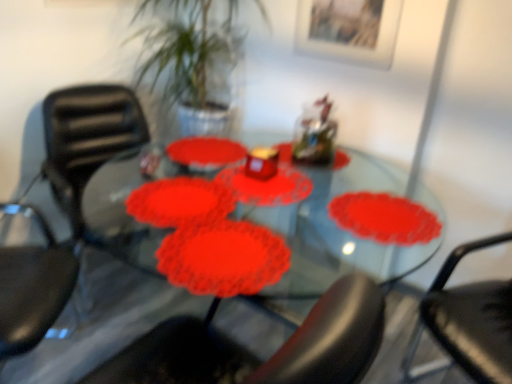
Describe the element at coordinates (468, 322) in the screenshot. I see `black plastic chair at right, acting as the 1th chair starting from the right` at that location.

What is the approximate width of black plastic chair at right, the second chair when ordered from left to right?

The width of black plastic chair at right, the second chair when ordered from left to right, is 29.70 inches.

The image size is (512, 384). I want to click on black plastic chair at right, the second chair when ordered from left to right, so click(x=468, y=322).

Image resolution: width=512 pixels, height=384 pixels. What are the coordinates of `matte black chair at left, the second chair in the right-to-left sequence` in the screenshot? It's located at (88, 145).

Describe the element at coordinates (88, 145) in the screenshot. I see `matte black chair at left, which ranks as the first chair in left-to-right order` at that location.

The height and width of the screenshot is (384, 512). Find the location of `black plastic chair at right, acting as the 1th chair starting from the right`. black plastic chair at right, acting as the 1th chair starting from the right is located at coordinates (468, 322).

Is black plastic chair at right, the second chair when ordered from left to right, at the left side of matte black chair at left, the second chair in the right-to-left sequence?

In fact, black plastic chair at right, the second chair when ordered from left to right, is to the right of matte black chair at left, the second chair in the right-to-left sequence.

Who is more distant, black plastic chair at right, the second chair when ordered from left to right, or matte black chair at left, which ranks as the first chair in left-to-right order?

Positioned behind is matte black chair at left, which ranks as the first chair in left-to-right order.

Which point is more forward, (451, 272) or (79, 150)?

The point (451, 272) is closer to the camera.

From the image's perspective, which one is positioned higher, black plastic chair at right, the second chair when ordered from left to right, or matte black chair at left, the second chair in the right-to-left sequence?

matte black chair at left, the second chair in the right-to-left sequence, is shown above in the image.

From a real-world perspective, which object stands above the other?

matte black chair at left, which ranks as the first chair in left-to-right order, is physically above.

Between black plastic chair at right, the second chair when ordered from left to right, and matte black chair at left, which ranks as the first chair in left-to-right order, which one has larger width?

With larger width is black plastic chair at right, the second chair when ordered from left to right.

Is black plastic chair at right, acting as the 1th chair starting from the right, taller or shorter than matte black chair at left, the second chair in the right-to-left sequence?

Clearly, black plastic chair at right, acting as the 1th chair starting from the right, is taller compared to matte black chair at left, the second chair in the right-to-left sequence.

Looking at the image, does black plastic chair at right, the second chair when ordered from left to right, seem bigger or smaller compared to matte black chair at left, the second chair in the right-to-left sequence?

black plastic chair at right, the second chair when ordered from left to right, is smaller than matte black chair at left, the second chair in the right-to-left sequence.

Would you say black plastic chair at right, acting as the 1th chair starting from the right, is outside matte black chair at left, the second chair in the right-to-left sequence?

Absolutely, black plastic chair at right, acting as the 1th chair starting from the right, is external to matte black chair at left, the second chair in the right-to-left sequence.

Are black plastic chair at right, the second chair when ordered from left to right, and matte black chair at left, which ranks as the first chair in left-to-right order, beside each other?

No, black plastic chair at right, the second chair when ordered from left to right, is not in contact with matte black chair at left, which ranks as the first chair in left-to-right order.

In the scene shown: Is black plastic chair at right, the second chair when ordered from left to right, turned away from matte black chair at left, the second chair in the right-to-left sequence?

black plastic chair at right, the second chair when ordered from left to right, does not have its back to matte black chair at left, the second chair in the right-to-left sequence.

How different are the orientations of black plastic chair at right, acting as the 1th chair starting from the right, and matte black chair at left, the second chair in the right-to-left sequence, in degrees?

105 degrees separate the facing orientations of black plastic chair at right, acting as the 1th chair starting from the right, and matte black chair at left, the second chair in the right-to-left sequence.

The height and width of the screenshot is (384, 512). Find the location of `chair to the left of black plastic chair at right, the second chair when ordered from left to right`. chair to the left of black plastic chair at right, the second chair when ordered from left to right is located at coordinates (88, 145).

Can you confirm if matte black chair at left, the second chair in the right-to-left sequence, is positioned to the right of black plastic chair at right, the second chair when ordered from left to right?

Incorrect, matte black chair at left, the second chair in the right-to-left sequence, is not on the right side of black plastic chair at right, the second chair when ordered from left to right.

Between matte black chair at left, which ranks as the first chair in left-to-right order, and black plastic chair at right, the second chair when ordered from left to right, which one is positioned in front?

Positioned in front is black plastic chair at right, the second chair when ordered from left to right.

Does point (80, 111) appear closer or farther from the camera than point (451, 257)?

Point (80, 111) is positioned farther from the camera compared to point (451, 257).

From the image's perspective, which one is positioned higher, matte black chair at left, the second chair in the right-to-left sequence, or black plastic chair at right, acting as the 1th chair starting from the right?

matte black chair at left, the second chair in the right-to-left sequence, from the image's perspective.

From the picture: From a real-world perspective, is matte black chair at left, which ranks as the first chair in left-to-right order, over black plastic chair at right, the second chair when ordered from left to right?

Correct, in the physical world, matte black chair at left, which ranks as the first chair in left-to-right order, is higher than black plastic chair at right, the second chair when ordered from left to right.

In terms of width, does matte black chair at left, which ranks as the first chair in left-to-right order, look wider or thinner when compared to black plastic chair at right, the second chair when ordered from left to right?

In the image, matte black chair at left, which ranks as the first chair in left-to-right order, appears to be more narrow than black plastic chair at right, the second chair when ordered from left to right.

Considering the relative sizes of matte black chair at left, which ranks as the first chair in left-to-right order, and black plastic chair at right, the second chair when ordered from left to right, in the image provided, is matte black chair at left, which ranks as the first chair in left-to-right order, shorter than black plastic chair at right, the second chair when ordered from left to right,?

Indeed, matte black chair at left, which ranks as the first chair in left-to-right order, has a lesser height compared to black plastic chair at right, the second chair when ordered from left to right.

Considering the sizes of objects matte black chair at left, the second chair in the right-to-left sequence, and black plastic chair at right, the second chair when ordered from left to right, in the image provided, who is smaller, matte black chair at left, the second chair in the right-to-left sequence, or black plastic chair at right, the second chair when ordered from left to right,?

black plastic chair at right, the second chair when ordered from left to right, is smaller.

Is matte black chair at left, which ranks as the first chair in left-to-right order, not within black plastic chair at right, acting as the 1th chair starting from the right?

That's correct, matte black chair at left, which ranks as the first chair in left-to-right order, is outside of black plastic chair at right, acting as the 1th chair starting from the right.

Would you consider matte black chair at left, which ranks as the first chair in left-to-right order, to be distant from black plastic chair at right, acting as the 1th chair starting from the right?

Yes, matte black chair at left, which ranks as the first chair in left-to-right order, and black plastic chair at right, acting as the 1th chair starting from the right, are located far from each other.

Is matte black chair at left, which ranks as the first chair in left-to-right order, facing away from black plastic chair at right, the second chair when ordered from left to right?

No, black plastic chair at right, the second chair when ordered from left to right, is not at the back of matte black chair at left, which ranks as the first chair in left-to-right order.

Can you tell me how much matte black chair at left, the second chair in the right-to-left sequence, and black plastic chair at right, the second chair when ordered from left to right, differ in facing direction?

105 degrees.

Where is `chair on the right of matte black chair at left, the second chair in the right-to-left sequence`? chair on the right of matte black chair at left, the second chair in the right-to-left sequence is located at coordinates (468, 322).

Where is `chair that is below the matte black chair at left, the second chair in the right-to-left sequence (from the image's perspective)`? The height and width of the screenshot is (384, 512). chair that is below the matte black chair at left, the second chair in the right-to-left sequence (from the image's perspective) is located at coordinates (468, 322).

This screenshot has height=384, width=512. What are the coordinates of `chair that is on the left side of black plastic chair at right, the second chair when ordered from left to right` in the screenshot? It's located at (88, 145).